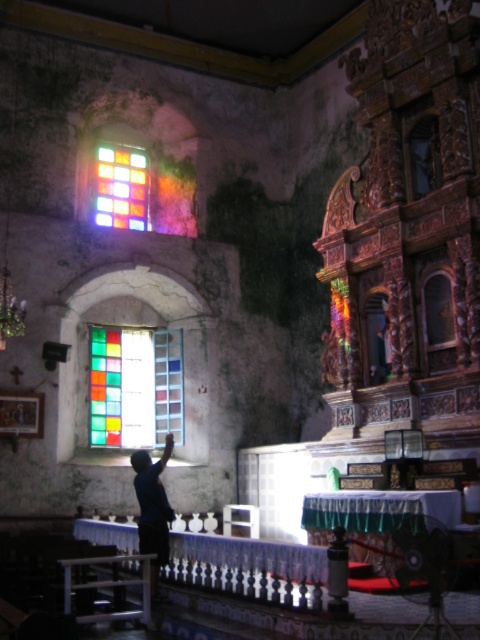
Question: Estimate the real-world distances between objects in this image. Which object is farther from the dark blue shirt at center?

Choices:
 (A) stained glass window at center
 (B) stained glass window at upper left

Answer: (B)

Question: Which object is positioned farthest from the stained glass window at upper left?

Choices:
 (A) stained glass window at center
 (B) dark blue shirt at center

Answer: (B)

Question: Which point appears closest to the camera in this image?

Choices:
 (A) (134, 476)
 (B) (179, 438)
 (C) (121, 168)

Answer: (A)

Question: Can you confirm if stained glass window at center is wider than dark blue shirt at center?

Choices:
 (A) yes
 (B) no

Answer: (A)

Question: Where is stained glass window at upper left located in relation to dark blue shirt at center in the image?

Choices:
 (A) left
 (B) right

Answer: (A)

Question: In this image, where is stained glass window at center located relative to dark blue shirt at center?

Choices:
 (A) above
 (B) below

Answer: (A)